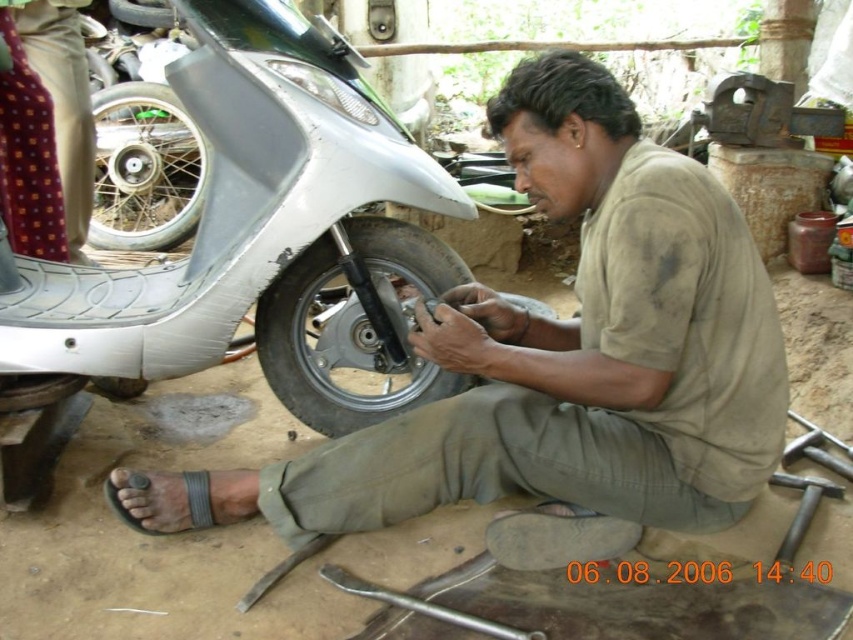
Is silver wire-spoke wheel at left in front of polka dot fabric at upper left?

No, silver wire-spoke wheel at left is behind polka dot fabric at upper left.

The height and width of the screenshot is (640, 853). What do you see at coordinates (144, 168) in the screenshot? I see `silver wire-spoke wheel at left` at bounding box center [144, 168].

Describe the element at coordinates (144, 168) in the screenshot. I see `silver wire-spoke wheel at left` at that location.

Locate an element on the screen. silver wire-spoke wheel at left is located at coordinates (144, 168).

Is white matte motorcycle at center further to camera compared to black rubber tire at center?

No, it is not.

Who is lower down, white matte motorcycle at center or black rubber tire at center?

Positioned lower is black rubber tire at center.

Where is `white matte motorcycle at center`? The image size is (853, 640). white matte motorcycle at center is located at coordinates [x=262, y=236].

Between point (302, 522) and point (195, 129), which one is positioned in front?

Point (302, 522) is in front.

Which of these two, brown cotton shirt at center or silver wire-spoke wheel at left, stands taller?

Standing taller between the two is brown cotton shirt at center.

Is point (712, 404) behind point (105, 186)?

No, it is not.

This screenshot has width=853, height=640. Find the location of `brown cotton shirt at center`. brown cotton shirt at center is located at coordinates (556, 356).